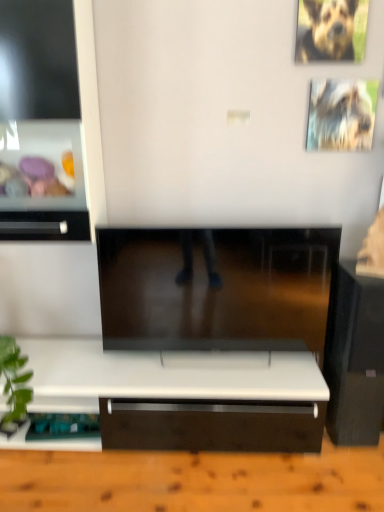
Question: Does brown fur dog at upper right have a greater width compared to black glossy speaker at right?

Choices:
 (A) yes
 (B) no

Answer: (B)

Question: Can you confirm if brown fur dog at upper right is positioned to the left of black glossy speaker at right?

Choices:
 (A) yes
 (B) no

Answer: (A)

Question: From the image's perspective, is brown fur dog at upper right above black glossy speaker at right?

Choices:
 (A) yes
 (B) no

Answer: (A)

Question: Is brown fur dog at upper right not within black glossy speaker at right?

Choices:
 (A) no
 (B) yes

Answer: (B)

Question: From a real-world perspective, is brown fur dog at upper right located higher than black glossy speaker at right?

Choices:
 (A) yes
 (B) no

Answer: (A)

Question: Does brown fur dog at upper right touch black glossy speaker at right?

Choices:
 (A) yes
 (B) no

Answer: (B)

Question: From a real-world perspective, is white glossy drawer at left on metallic silver picture frame at upper right?

Choices:
 (A) yes
 (B) no

Answer: (B)

Question: Is white glossy drawer at left positioned beyond the bounds of metallic silver picture frame at upper right?

Choices:
 (A) yes
 (B) no

Answer: (A)

Question: Would you consider white glossy drawer at left to be distant from metallic silver picture frame at upper right?

Choices:
 (A) yes
 (B) no

Answer: (A)

Question: Could you tell me if white glossy drawer at left is turned towards metallic silver picture frame at upper right?

Choices:
 (A) yes
 (B) no

Answer: (B)

Question: Is white glossy drawer at left positioned in front of metallic silver picture frame at upper right?

Choices:
 (A) no
 (B) yes

Answer: (B)

Question: Does white glossy drawer at left appear on the left side of metallic silver picture frame at upper right?

Choices:
 (A) no
 (B) yes

Answer: (B)

Question: Is black glossy speaker at right oriented towards brown fur dog at upper right?

Choices:
 (A) no
 (B) yes

Answer: (A)